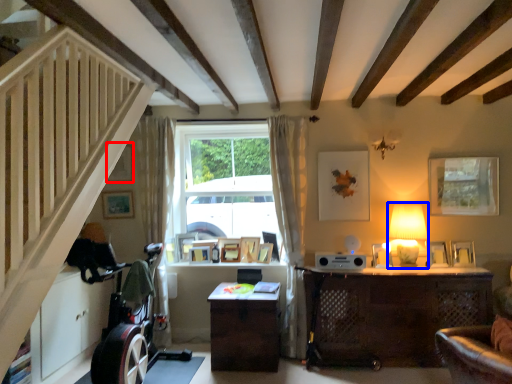
Question: Which point is closer to the camera, picture frame (highlighted by a red box) or table lamp (highlighted by a blue box)?

Choices:
 (A) picture frame
 (B) table lamp

Answer: (B)